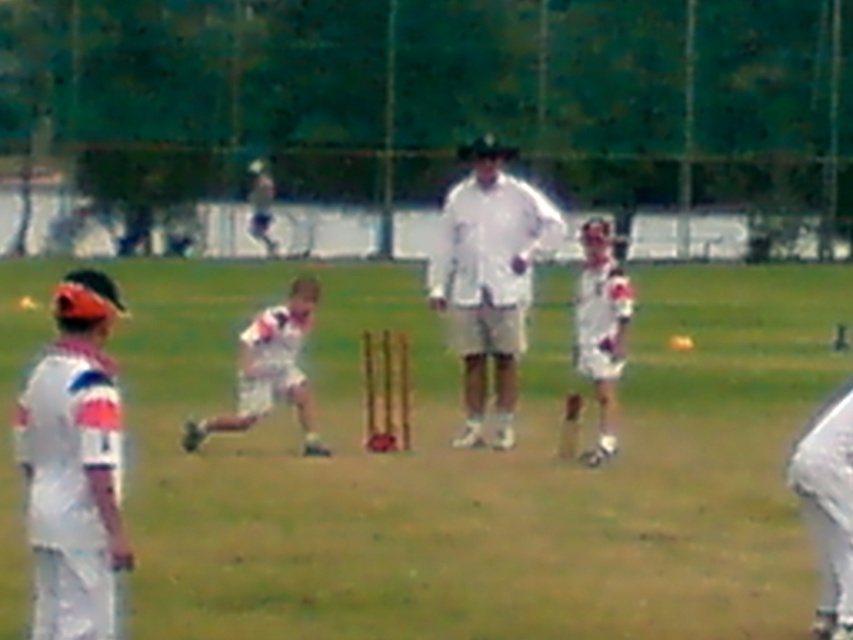
You are a photographer trying to capture the cricket match. You notice two players wearing white fabric uniform at center and white cotton shirt at center. Which player should you focus on to get a clearer shot if you want someone taller?

The white fabric uniform at center is much taller than the white cotton shirt at center, so focusing on the white fabric uniform at center would result in a clearer shot of a taller player.

You are a photographer trying to capture a clear shot of both the white fabric uniform at center and the white cotton shirt at center during the cricket match. Since the image is slightly blurred, which object should you focus on to ensure clarity, the larger or the smaller one?

The white fabric uniform at center is bigger than white cotton shirt at center. Focus on the larger white fabric uniform at center for better clarity as larger objects are generally easier to capture clearly in photographs.

You are a photographer trying to capture a clear shot of both the white matte shirt at center and the white cotton shirt at center during the cricket match. Since the image is slightly blurred, you want to adjust your focus. Which shirt should you focus on first to ensure it appears clearer in the photo?

The white matte shirt at center is larger in size than the white cotton shirt at center, so focusing on the white matte shirt at center first will ensure it appears clearer in the photo.